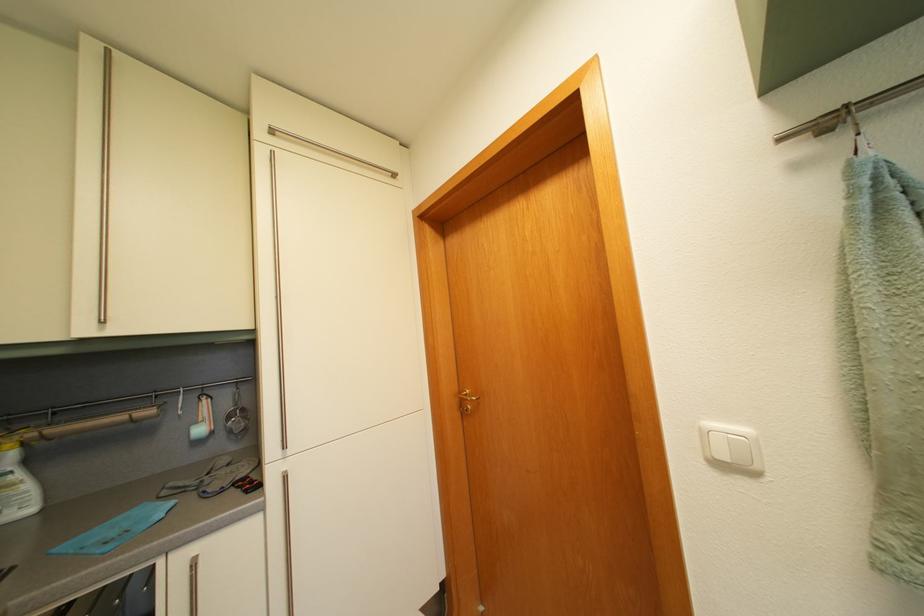
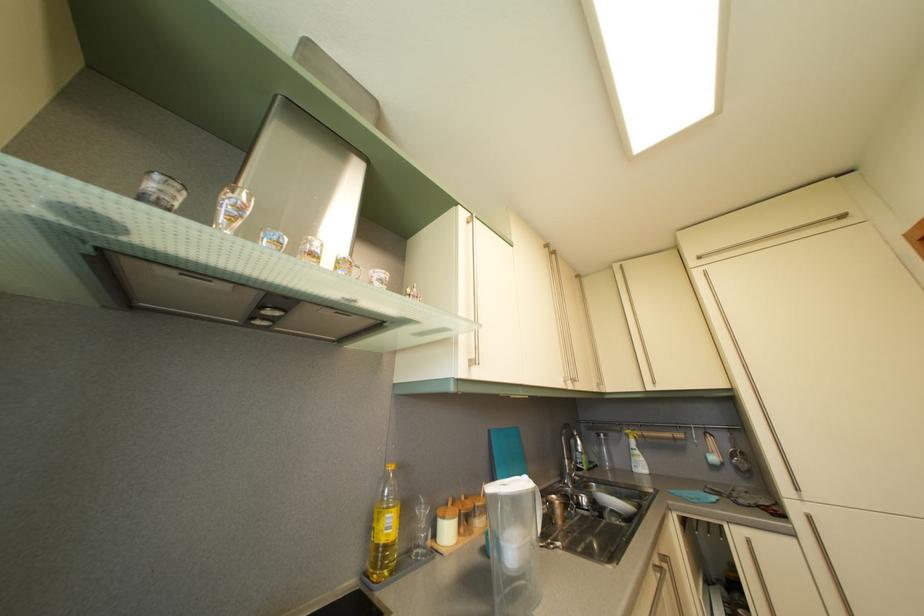
The images are taken continuously from a first-person perspective. In which direction is your viewpoint rotating?

The camera's rotation is toward left-up.